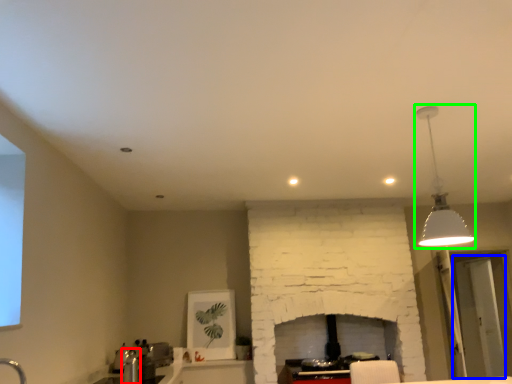
Question: Estimate the real-world distances between objects in this image. Which object is closer to faucet (highlighted by a red box), glass door (highlighted by a blue box) or lamp (highlighted by a green box)?

Choices:
 (A) glass door
 (B) lamp

Answer: (B)